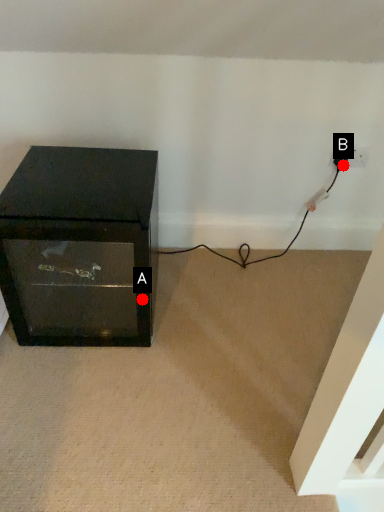
Question: Two points are circled on the image, labeled by A and B beside each circle. Which of the following is the closest to the observer?

Choices:
 (A) A is closer
 (B) B is closer

Answer: (A)